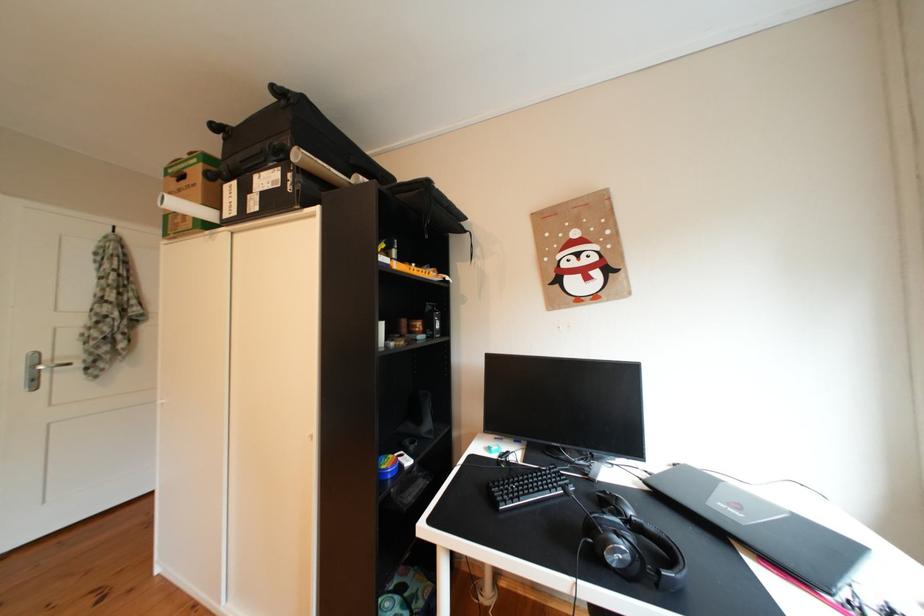
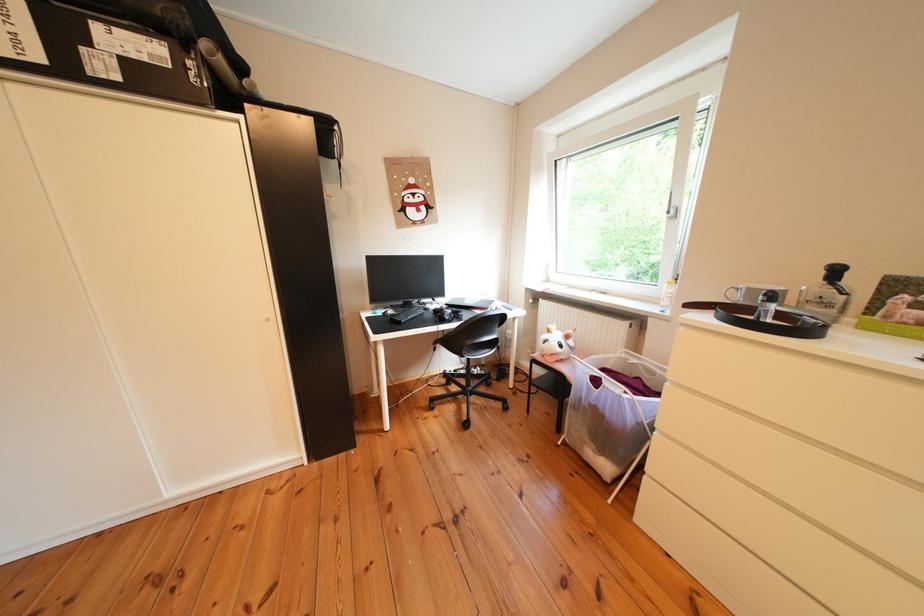
Where in the second image is the point corresponding to [272,213] from the first image?

(131, 83)